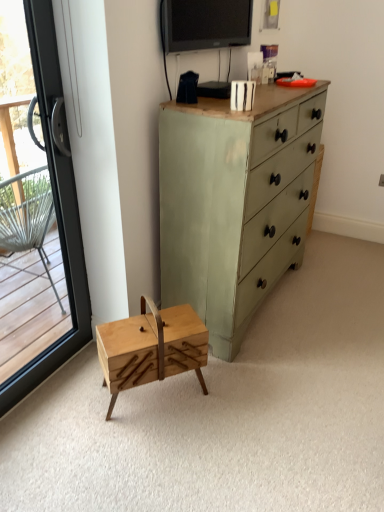
Image resolution: width=384 pixels, height=512 pixels. What are the coordinates of `free space below natural wood sewing box at center (from a real-world perspective)` in the screenshot? It's located at (160, 391).